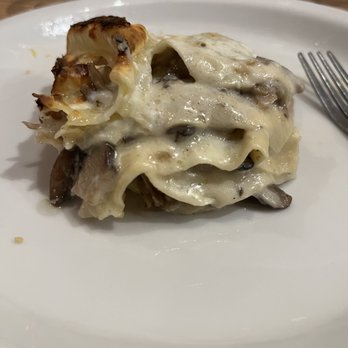
You are a GUI agent. You are given a task and a screenshot of the screen. Output one action in this format:
    pyautogui.click(x=<x>, y=<y>)
    Task: Click on the white plate to right of food
    The height and width of the screenshot is (348, 348).
    Given the screenshot: What is the action you would take?
    pyautogui.click(x=326, y=131)